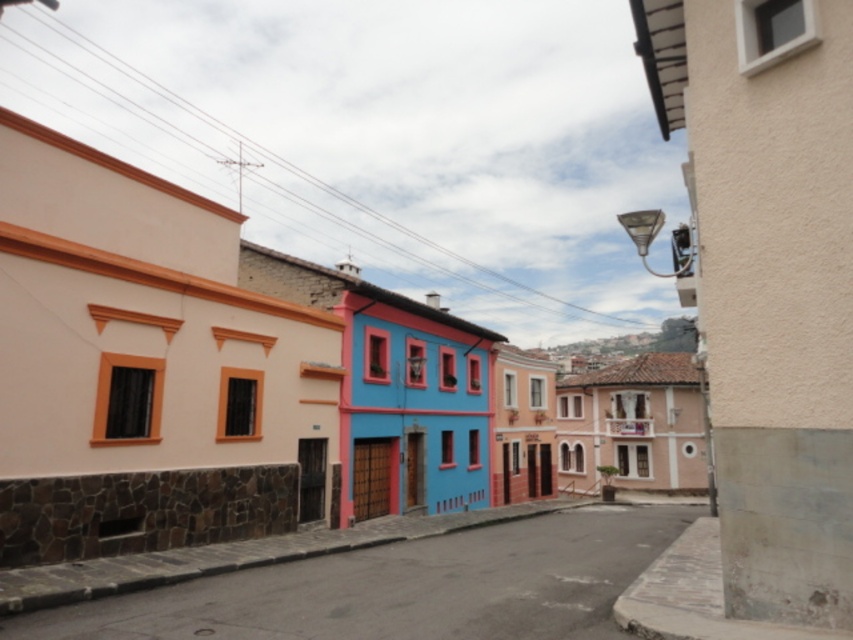
Question: From the image, what is the correct spatial relationship of smooth stucco building at center in relation to smooth concrete pavement at center?

Choices:
 (A) right
 (B) left

Answer: (B)

Question: Where is smooth stucco building at center located in relation to smooth concrete pavement at center in the image?

Choices:
 (A) right
 (B) left

Answer: (B)

Question: Observing the image, what is the correct spatial positioning of smooth stucco building at center in reference to smooth concrete pavement at center?

Choices:
 (A) left
 (B) right

Answer: (A)

Question: Which point is farther to the camera?

Choices:
 (A) smooth stucco building at center
 (B) smooth concrete pavement at center

Answer: (A)

Question: Which object appears closest to the camera in this image?

Choices:
 (A) smooth stucco building at center
 (B) smooth concrete pavement at center

Answer: (B)

Question: Among these points, which one is nearest to the camera?

Choices:
 (A) (10, 332)
 (B) (561, 515)

Answer: (A)